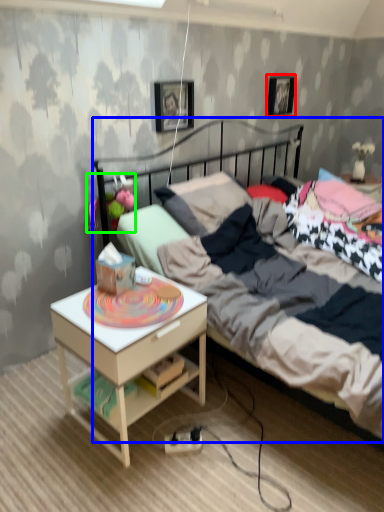
Question: Estimate the real-world distances between objects in this image. Which object is farther from picture frame (highlighted by a red box), bed (highlighted by a blue box) or toy (highlighted by a green box)?

Choices:
 (A) bed
 (B) toy

Answer: (B)